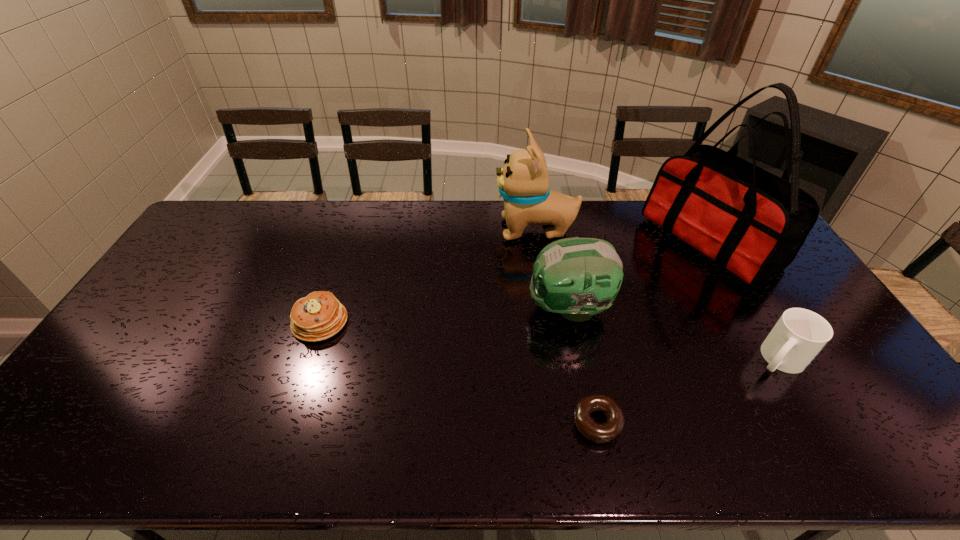
Where is `blank area located on the face of the puppy`? blank area located on the face of the puppy is located at coordinates (398, 230).

You are a GUI agent. You are given a task and a screenshot of the screen. Output one action in this format:
    pyautogui.click(x=<x>, y=<y>)
    Task: Click on the free location located on the face of the puppy
    
    Given the screenshot: What is the action you would take?
    pyautogui.click(x=401, y=230)

Find the location of a particular element. The height and width of the screenshot is (540, 960). vacant position located 0.130m on the visor of the fourth shortest object is located at coordinates (485, 308).

Where is `free region located 0.290m on the visor of the fourth shortest object`? The width and height of the screenshot is (960, 540). free region located 0.290m on the visor of the fourth shortest object is located at coordinates (431, 308).

Find the location of a particular element. blank space located 0.070m on the visor of the fourth shortest object is located at coordinates (504, 308).

This screenshot has width=960, height=540. Identify the location of free space located 0.200m on the left of the third shortest object. (678, 359).

The height and width of the screenshot is (540, 960). I want to click on vacant area situated 0.260m on the back of the leftmost object, so click(346, 247).

The image size is (960, 540). What are the coordinates of `vacant space situated on the left of the nearest object` in the screenshot? It's located at (466, 422).

You are a GUI agent. You are given a task and a screenshot of the screen. Output one action in this format:
    pyautogui.click(x=<x>, y=<y>)
    Task: Click on the duffel bag that is at the far edge
    The image size is (960, 540).
    Given the screenshot: What is the action you would take?
    pyautogui.click(x=752, y=223)

At what (x,y) coordinates should I click in order to perform the action: click on puppy that is at the far edge. Please return your answer as a coordinate pair (x, y). This screenshot has width=960, height=540. Looking at the image, I should click on (523, 182).